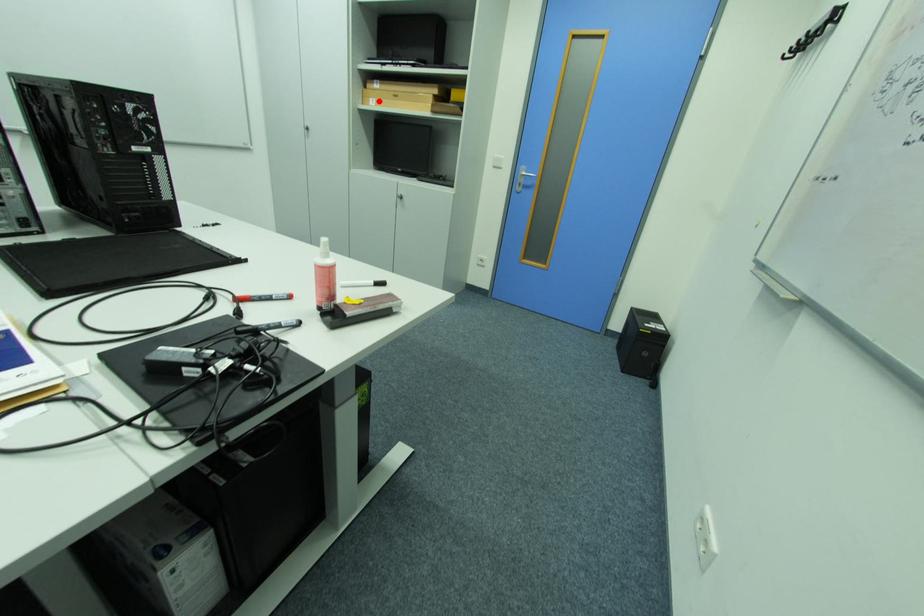
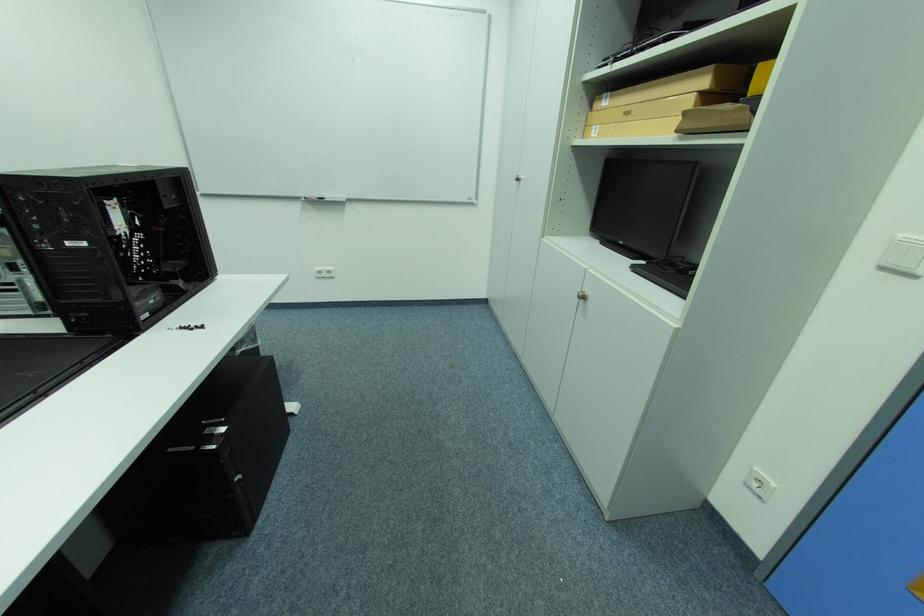
In the second image, find the point that corresponds to the highlighted location in the first image.

(602, 128)